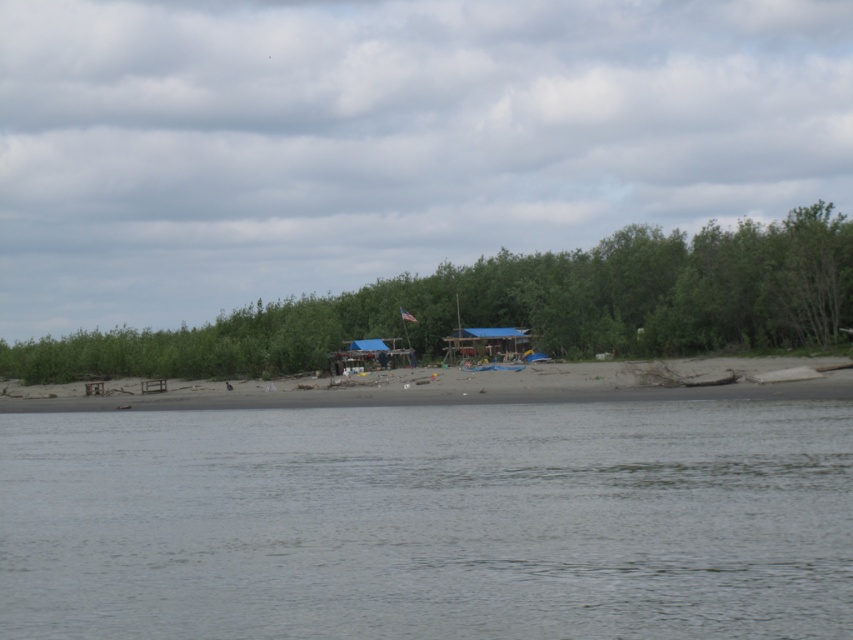
Which is in front, point (610, 592) or point (206, 385)?

Point (610, 592)

Is gray water at center positioned at the back of beige sand beach at center?

No, it is not.

In order to click on gray water at center in this screenshot , I will do `click(430, 522)`.

Locate an element on the screen. The height and width of the screenshot is (640, 853). gray water at center is located at coordinates (430, 522).

Is green leafy trees at center smaller than beige sand beach at center?

Incorrect, green leafy trees at center is not smaller in size than beige sand beach at center.

Is green leafy trees at center closer to the viewer compared to beige sand beach at center?

No, it is behind beige sand beach at center.

The image size is (853, 640). Identify the location of green leafy trees at center. click(x=518, y=305).

Can you confirm if gray water at center is shorter than green leafy trees at center?

Correct, gray water at center is not as tall as green leafy trees at center.

Can you confirm if gray water at center is thinner than green leafy trees at center?

Indeed, gray water at center has a lesser width compared to green leafy trees at center.

Between point (839, 449) and point (134, 362), which one is positioned behind?

Point (134, 362)

This screenshot has height=640, width=853. What are the coordinates of `gray water at center` in the screenshot? It's located at [430, 522].